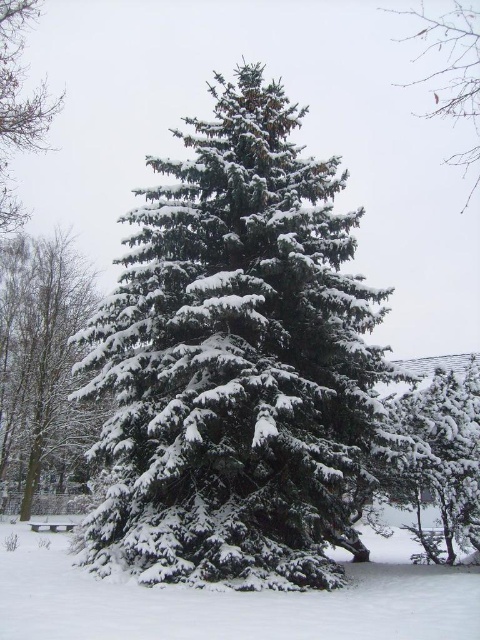
Question: Is snow-covered tree at left wider than green matte pine tree at upper right?

Choices:
 (A) yes
 (B) no

Answer: (B)

Question: Which object is farther from the camera taking this photo?

Choices:
 (A) white fluffy snow at center
 (B) snow-covered tree at left

Answer: (B)

Question: Which of these objects is positioned farthest from the green matte evergreen tree at center?

Choices:
 (A) green matte tree at upper left
 (B) white fluffy snow at center
 (C) green matte pine tree at upper right

Answer: (C)

Question: Which point is closer to the camera?

Choices:
 (A) (101, 452)
 (B) (34, 369)

Answer: (A)

Question: In this image, where is green matte evergreen tree at center located relative to green matte tree at upper left?

Choices:
 (A) above
 (B) below

Answer: (B)

Question: Is snow-covered tree at left smaller than green matte tree at upper left?

Choices:
 (A) no
 (B) yes

Answer: (B)